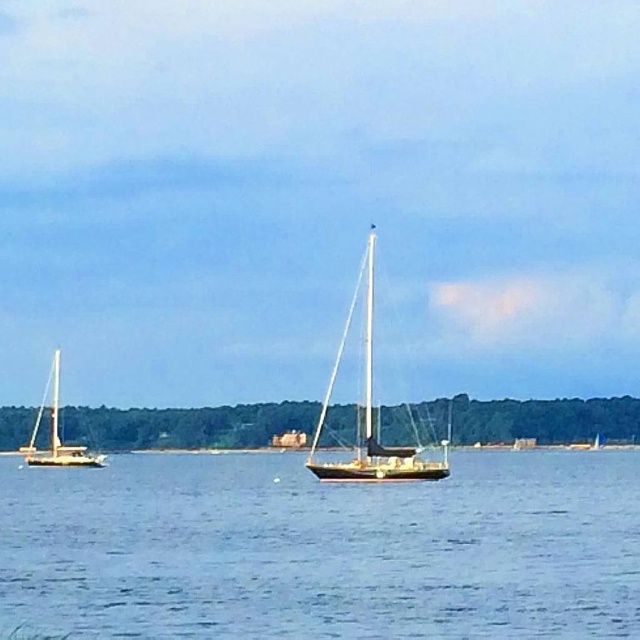
Does wooden sailboat at center lie in front of wooden sailboat at left?

Yes, it is.

In the scene shown: Can you confirm if wooden sailboat at center is shorter than wooden sailboat at left?

Incorrect, wooden sailboat at center's height does not fall short of wooden sailboat at left's.

You are a GUI agent. You are given a task and a screenshot of the screen. Output one action in this format:
    pyautogui.click(x=<x>, y=<y>)
    Task: Click on the wooden sailboat at center
    The width and height of the screenshot is (640, 640).
    Given the screenshot: What is the action you would take?
    pyautogui.click(x=371, y=413)

This screenshot has width=640, height=640. Find the location of `wooden sailboat at center`. wooden sailboat at center is located at coordinates (371, 413).

Can you confirm if clear blue water at center is thinner than wooden sailboat at center?

In fact, clear blue water at center might be wider than wooden sailboat at center.

Between clear blue water at center and wooden sailboat at center, which one appears on the right side from the viewer's perspective?

From the viewer's perspective, wooden sailboat at center appears more on the right side.

I want to click on clear blue water at center, so click(x=323, y=548).

Where is `clear blue water at center`? clear blue water at center is located at coordinates (323, 548).

Is clear blue water at center bigger than wooden sailboat at left?

Yes, clear blue water at center is bigger than wooden sailboat at left.

Image resolution: width=640 pixels, height=640 pixels. Identify the location of clear blue water at center. (323, 548).

Which is behind, point (332, 563) or point (58, 426)?

Positioned behind is point (58, 426).

What are the coordinates of `clear blue water at center` in the screenshot? It's located at (323, 548).